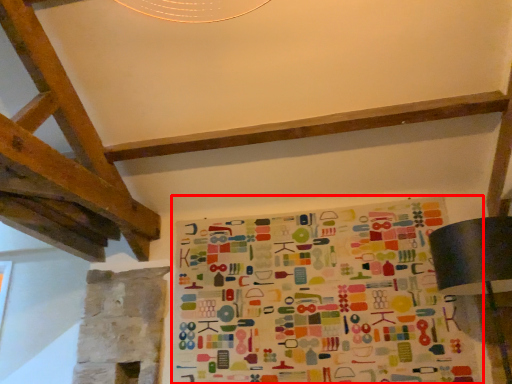
Question: Where is bulletin board (annotated by the red box) located in relation to table lamp in the image?

Choices:
 (A) left
 (B) right

Answer: (A)